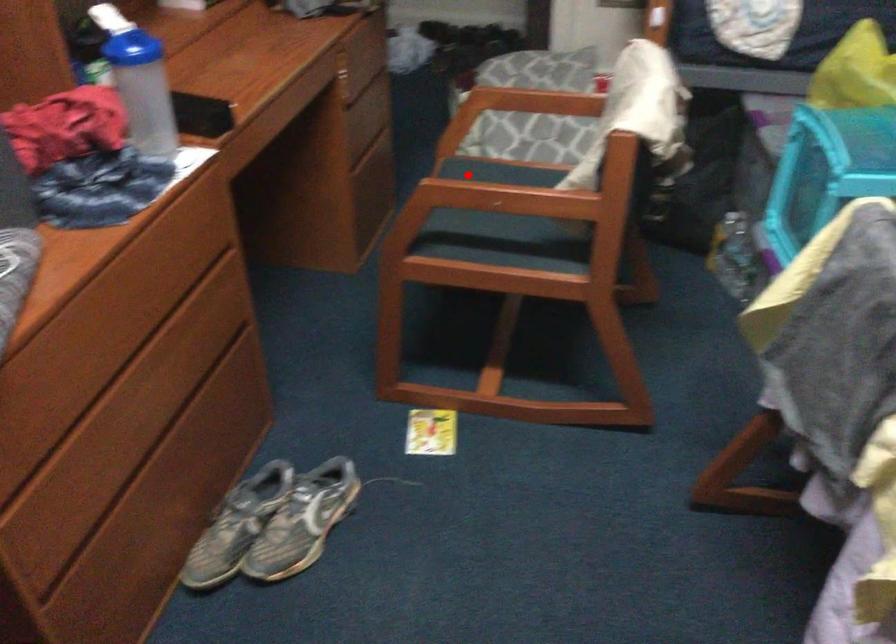
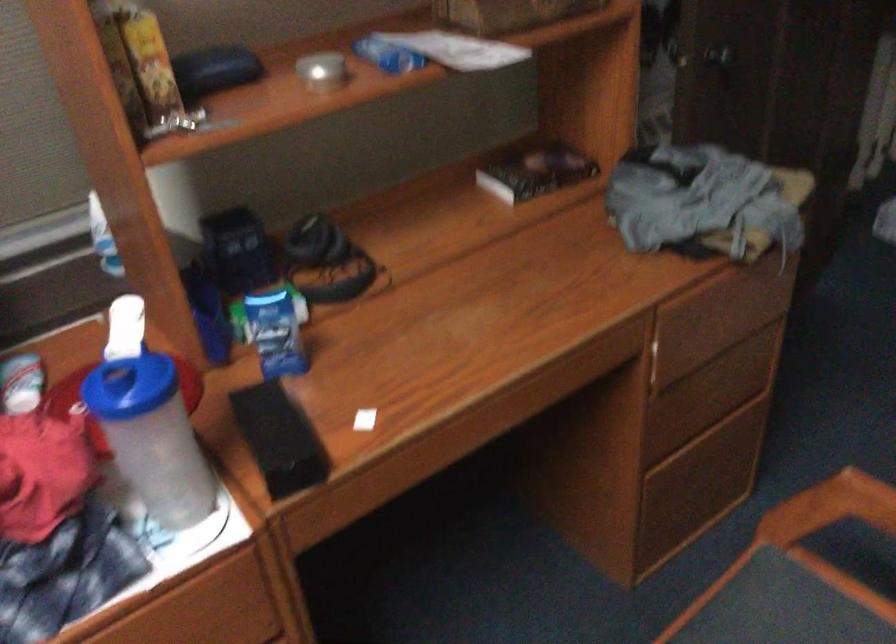
Question: I am providing you with two images of the same scene from different viewpoints. Given a red point in image1, look at the same physical point in image2. Is it:

Choices:
 (A) Closer to the viewpoint
 (B) Farther from the viewpoint

Answer: (A)